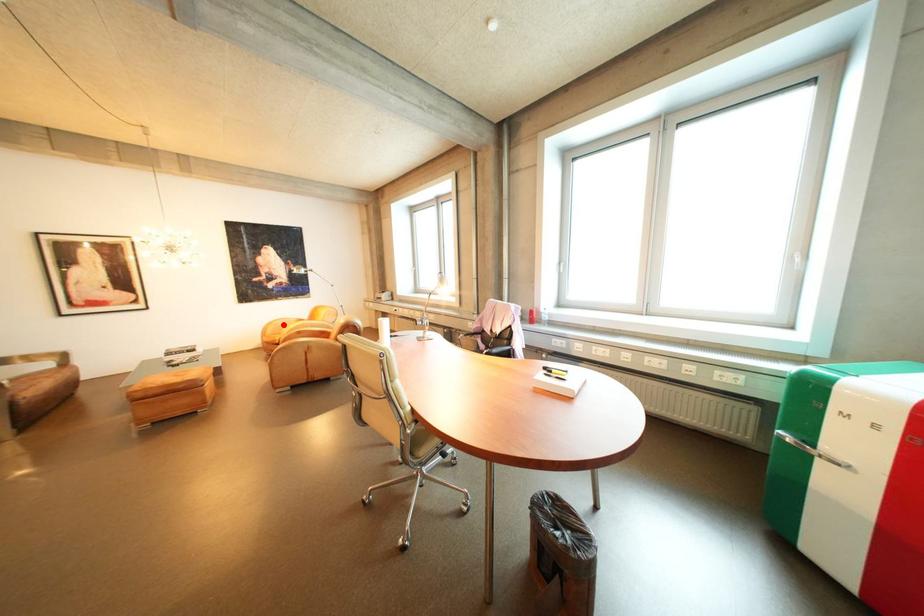
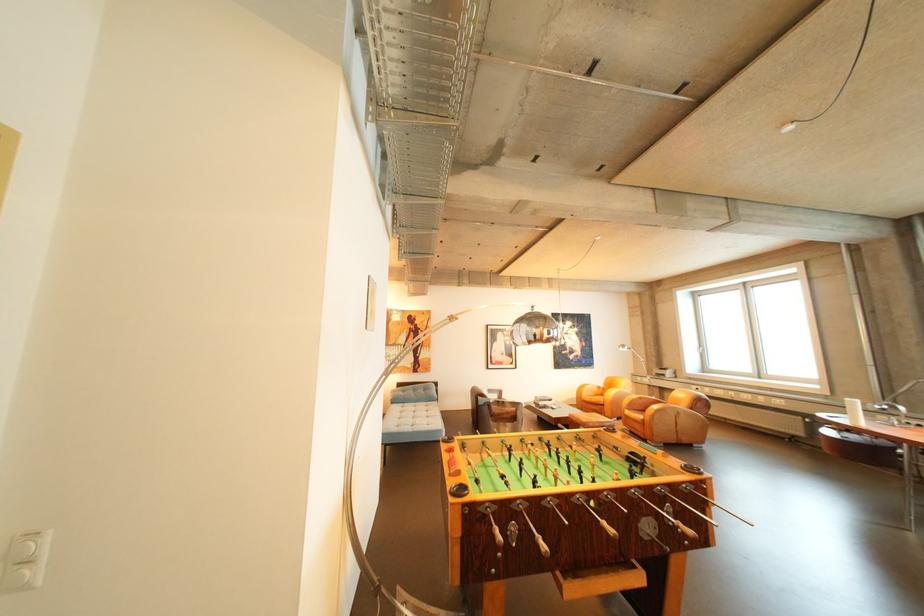
Question: I am providing you with two images of the same scene from different viewpoints. In image1, a red point is highlighted. Considering the same 3D point in image2, which of the following is correct?

Choices:
 (A) It is closer
 (B) It is farther

Answer: (B)